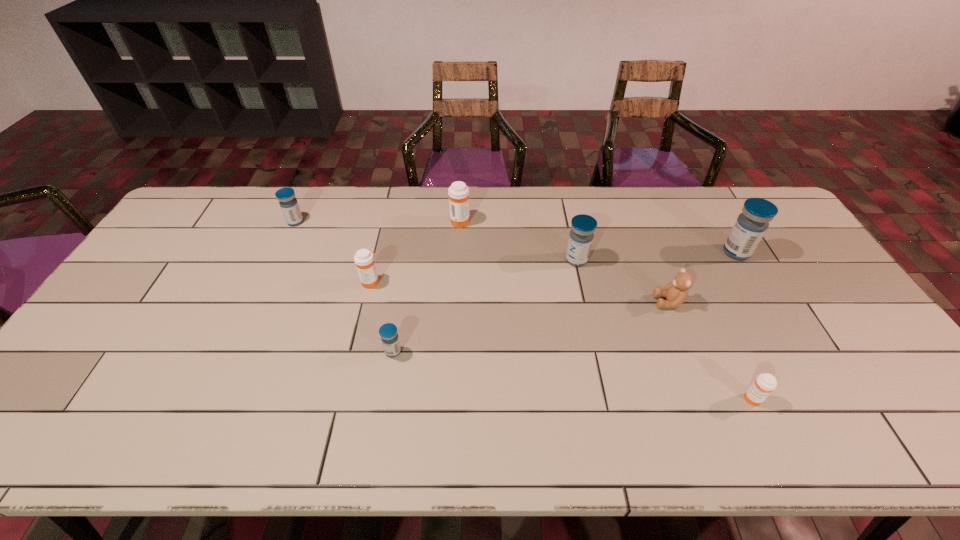
This screenshot has width=960, height=540. Identify the location of vacant area that lies between the rightmost blue medicine and the second smallest blue medicine. (516, 237).

What are the coordinates of `free space between the third nearest medicine and the second nearest medicine` in the screenshot? It's located at (382, 317).

Identify the location of the closest object to the brown teddy bear. (583, 226).

I want to click on object that stands as the fifth closest to the teddy bear, so click(x=388, y=332).

Select which medicine appears as the sixth closest to the rightmost orange medicine. Please provide its 2D coordinates. Your answer should be formatted as a tuple, i.e. [(x, y)], where the tuple contains the x and y coordinates of a point satisfying the conditions above.

[(289, 205)]

At what (x,y) coordinates should I click in order to perform the action: click on medicine that stands as the sixth closest to the smallest orange medicine. Please return your answer as a coordinate pair (x, y). Looking at the image, I should click on (289, 205).

Point out which blue medicine is positioned as the fourth nearest to the biggest orange medicine. Please provide its 2D coordinates. Your answer should be formatted as a tuple, i.e. [(x, y)], where the tuple contains the x and y coordinates of a point satisfying the conditions above.

[(750, 226)]

At what (x,y) coordinates should I click in order to perform the action: click on blue medicine that is the second closest one to the fourth object from left to right. Please return your answer as a coordinate pair (x, y). The height and width of the screenshot is (540, 960). Looking at the image, I should click on (388, 332).

You are a GUI agent. You are given a task and a screenshot of the screen. Output one action in this format:
    pyautogui.click(x=<x>, y=<y>)
    Task: Click on the second closest orange medicine to the sixth object from left to right
    The image size is (960, 540).
    Given the screenshot: What is the action you would take?
    pyautogui.click(x=458, y=192)

Locate which orange medicine ranks in proximity to the fifth medicine from left to right. Please provide its 2D coordinates. Your answer should be formatted as a tuple, i.e. [(x, y)], where the tuple contains the x and y coordinates of a point satisfying the conditions above.

[(458, 192)]